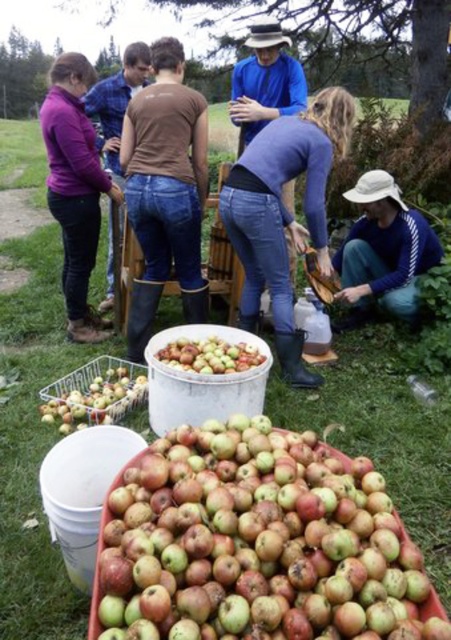
Between rusty metallic apples at lower center and white fabric hat at lower right, which one appears on the right side from the viewer's perspective?

white fabric hat at lower right

Does rusty metallic apples at lower center appear on the right side of white fabric hat at lower right?

In fact, rusty metallic apples at lower center is to the left of white fabric hat at lower right.

I want to click on rusty metallic apples at lower center, so click(257, 544).

This screenshot has height=640, width=451. Find the location of `rusty metallic apples at lower center`. rusty metallic apples at lower center is located at coordinates (257, 544).

Between point (272, 221) and point (65, 262), which one is positioned in front?

Point (272, 221) is more forward.

Does blue jeans at center appear under matte purple sweater at left?

Indeed, blue jeans at center is positioned under matte purple sweater at left.

Image resolution: width=451 pixels, height=640 pixels. What do you see at coordinates (284, 212) in the screenshot? I see `blue jeans at center` at bounding box center [284, 212].

Where is `blue jeans at center`? This screenshot has width=451, height=640. blue jeans at center is located at coordinates (284, 212).

Image resolution: width=451 pixels, height=640 pixels. I want to click on matte purple sweater at left, so click(x=74, y=188).

What do you see at coordinates (74, 188) in the screenshot?
I see `matte purple sweater at left` at bounding box center [74, 188].

You are a GUI agent. You are given a task and a screenshot of the screen. Output one action in this format:
    pyautogui.click(x=<x>, y=<y>)
    Task: Click on the matte purple sweater at left
    
    Given the screenshot: What is the action you would take?
    click(x=74, y=188)